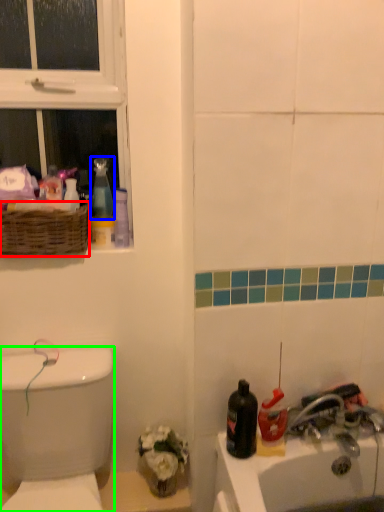
Question: Estimate the real-world distances between objects in this image. Which object is closer to basket (highlighted by a red box), cleaning product (highlighted by a blue box) or porcelain (highlighted by a green box)?

Choices:
 (A) cleaning product
 (B) porcelain

Answer: (A)